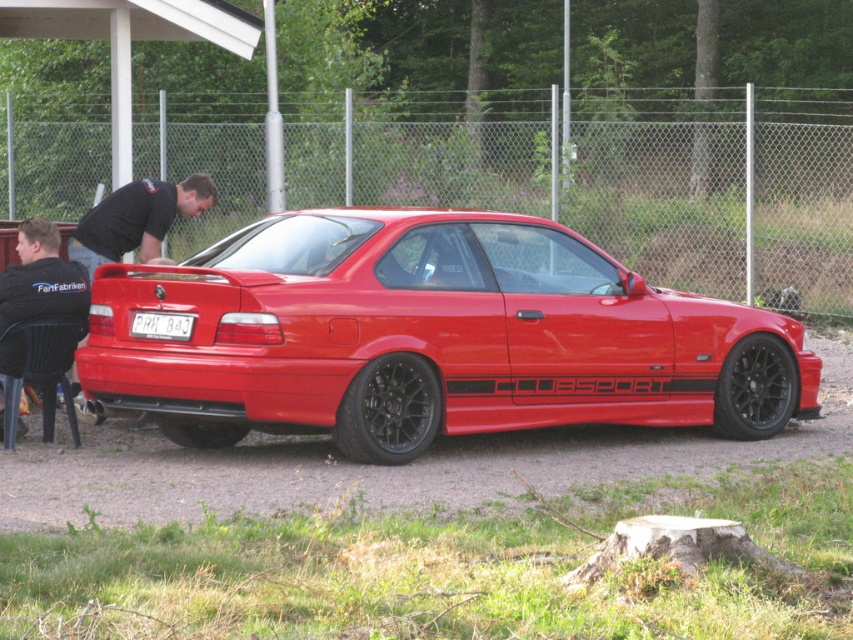
Question: Where is black matte tire at center located in relation to white plastic license plate at center in the image?

Choices:
 (A) right
 (B) left

Answer: (A)

Question: Is black matte tire at center to the right of black matte tire at lower right from the viewer's perspective?

Choices:
 (A) no
 (B) yes

Answer: (A)

Question: Which of the following is the farthest from the observer?

Choices:
 (A) (431, 440)
 (B) (758, 337)
 (C) (100, 208)
 (D) (137, 328)

Answer: (C)

Question: Which of these objects is positioned farthest from the black matte tire at center?

Choices:
 (A) black fabric shirt at lower left
 (B) black fabric shirt at upper left
 (C) black rubber tire at lower center
 (D) black fabric shirt at upper center

Answer: (B)

Question: Which object is closer to the camera taking this photo?

Choices:
 (A) black fabric shirt at upper center
 (B) black matte tire at lower right
 (C) glossy red sports car at center
 (D) black fabric shirt at lower left

Answer: (C)

Question: Is black matte tire at center thinner than black fabric shirt at upper center?

Choices:
 (A) no
 (B) yes

Answer: (B)